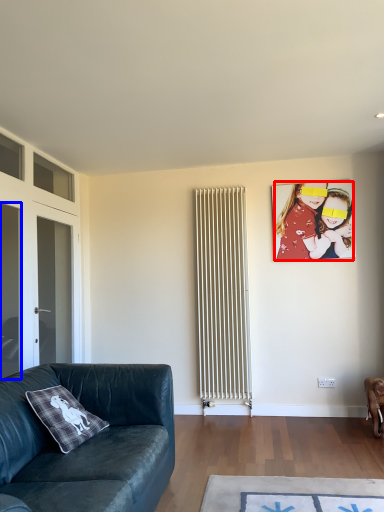
Question: Which object is closer to the camera taking this photo, person (highlighted by a red box) or glass door (highlighted by a blue box)?

Choices:
 (A) person
 (B) glass door

Answer: (B)